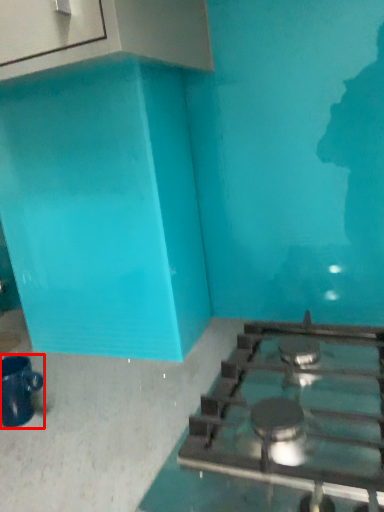
Question: From the image's perspective, where is coffee cup (annotated by the red box) located relative to gas stove?

Choices:
 (A) below
 (B) above

Answer: (A)